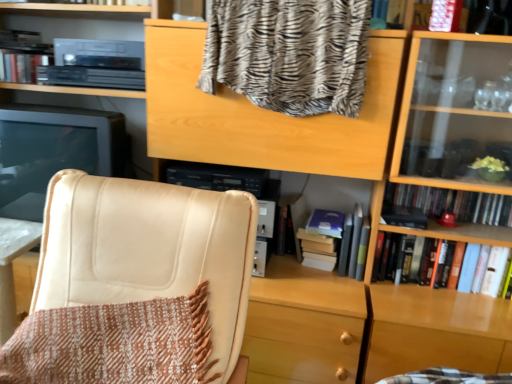
What do you see at coordinates (135, 285) in the screenshot? The height and width of the screenshot is (384, 512). I see `beige leather chair at left` at bounding box center [135, 285].

The width and height of the screenshot is (512, 384). Describe the element at coordinates (452, 203) in the screenshot. I see `hardcover book at right, the second book when ordered from top to bottom` at that location.

You are a GUI agent. You are given a task and a screenshot of the screen. Output one action in this format:
    pyautogui.click(x=<x>, y=<y>)
    Task: Click on the zebra-patterned fabric at upper center, which is the 1th blanket in top-to-bottom order
    
    Given the screenshot: What is the action you would take?
    (x=289, y=53)

The image size is (512, 384). Describe the element at coordinates (21, 66) in the screenshot. I see `hardcover book at left, the fourth book from the bottom` at that location.

Looking at this image, what is the approximate height of gray matte book at center, arranged as the second book when viewed from the left?

It is 10.33 inches.

This screenshot has width=512, height=384. What do you see at coordinates (415, 259) in the screenshot?
I see `hardcover book at right, the 3th book viewed from the left` at bounding box center [415, 259].

The height and width of the screenshot is (384, 512). What are the coordinates of `beige leather chair at left` in the screenshot? It's located at (135, 285).

Which is more to the right, hardcover book at right, acting as the second book starting from the right, or satin black monitor at left?

hardcover book at right, acting as the second book starting from the right.

How many degrees apart are the facing directions of hardcover book at right, which appears as the 4th book when viewed from the top, and satin black monitor at left?

They differ by 3.62 degrees in their facing directions.

Considering the relative sizes of hardcover book at right, the 3th book viewed from the left, and satin black monitor at left in the image provided, is hardcover book at right, the 3th book viewed from the left, smaller than satin black monitor at left?

Yes, hardcover book at right, the 3th book viewed from the left, is smaller than satin black monitor at left.

Which is closer to the camera, (454,258) or (22,211)?

Point (454,258).

Is point (9, 68) less distant than point (104, 131)?

No, (9, 68) is behind (104, 131).

Looking at their sizes, would you say hardcover book at left, which ranks as the 4th book in right-to-left order, is wider or thinner than satin black monitor at left?

Considering their sizes, hardcover book at left, which ranks as the 4th book in right-to-left order, looks slimmer than satin black monitor at left.

Does hardcover book at left, the 1th book from the left, have a lesser height compared to satin black monitor at left?

Yes.

Is hardcover book at left, which ranks as the 4th book in right-to-left order, aimed at satin black monitor at left?

No, hardcover book at left, which ranks as the 4th book in right-to-left order, is not facing towards satin black monitor at left.

Which is correct: hardcover book at left, which is the first book from top to bottom, is inside beige leather chair at left, or outside of it?

The correct answer is: outside.

Is hardcover book at left, which ranks as the 4th book in right-to-left order, aimed at beige leather chair at left?

No, hardcover book at left, which ranks as the 4th book in right-to-left order, is not oriented towards beige leather chair at left.

Is point (1, 58) farther from viewer compared to point (99, 258)?

Yes, point (1, 58) is behind point (99, 258).

Considering the relative sizes of brown woven blanket at lower left, the 2th blanket in the top-to-bottom sequence, and hardcover book at right, which ranks as the first book in right-to-left order, in the image provided, is brown woven blanket at lower left, the 2th blanket in the top-to-bottom sequence, taller than hardcover book at right, which ranks as the first book in right-to-left order,?

Yes, brown woven blanket at lower left, the 2th blanket in the top-to-bottom sequence, is taller than hardcover book at right, which ranks as the first book in right-to-left order.

Is the surface of brown woven blanket at lower left, which appears as the 1th blanket when ordered from the bottom, in direct contact with hardcover book at right, the second book when ordered from top to bottom?

They are not placed beside each other.

Locate an element on the screen. The height and width of the screenshot is (384, 512). blanket that appears below the hardcover book at right, which ranks as the 3th book in bottom-to-top order (from a real-world perspective) is located at coordinates (113, 344).

Is brown woven blanket at lower left, the 2th blanket in the top-to-bottom sequence, oriented towards hardcover book at right, which ranks as the 3th book in bottom-to-top order?

No, brown woven blanket at lower left, the 2th blanket in the top-to-bottom sequence, is not aimed at hardcover book at right, which ranks as the 3th book in bottom-to-top order.

Can you confirm if brown woven blanket at lower left, the 2th blanket in the top-to-bottom sequence, is positioned to the right of satin black monitor at left?

Yes, brown woven blanket at lower left, the 2th blanket in the top-to-bottom sequence, is to the right of satin black monitor at left.

Based on the photo, who is taller, brown woven blanket at lower left, the 2th blanket in the top-to-bottom sequence, or satin black monitor at left?

With more height is satin black monitor at left.

Is brown woven blanket at lower left, which appears as the 1th blanket when ordered from the bottom, aimed at satin black monitor at left?

No, brown woven blanket at lower left, which appears as the 1th blanket when ordered from the bottom, is not turned towards satin black monitor at left.

In the scene shown: Is brown woven blanket at lower left, which appears as the 1th blanket when ordered from the bottom, outside of satin black monitor at left?

brown woven blanket at lower left, which appears as the 1th blanket when ordered from the bottom, is positioned outside satin black monitor at left.

Based on the photo, visually, is brown woven blanket at lower left, which appears as the 1th blanket when ordered from the bottom, positioned to the left or to the right of hardcover book at left, which ranks as the 4th book in right-to-left order?

Clearly, brown woven blanket at lower left, which appears as the 1th blanket when ordered from the bottom, is on the right of hardcover book at left, which ranks as the 4th book in right-to-left order, in the image.

How many degrees apart are the facing directions of brown woven blanket at lower left, which appears as the 1th blanket when ordered from the bottom, and hardcover book at left, which is the first book from top to bottom?

A: 0.0821 degrees.

Does brown woven blanket at lower left, the 2th blanket in the top-to-bottom sequence, have a lesser width compared to hardcover book at left, which is the first book from top to bottom?

Incorrect, the width of brown woven blanket at lower left, the 2th blanket in the top-to-bottom sequence, is not less than that of hardcover book at left, which is the first book from top to bottom.

Looking at the image, does brown woven blanket at lower left, which appears as the 1th blanket when ordered from the bottom, seem bigger or smaller compared to hardcover book at left, which is the first book from top to bottom?

Considering their sizes, brown woven blanket at lower left, which appears as the 1th blanket when ordered from the bottom, takes up more space than hardcover book at left, which is the first book from top to bottom.

Consider the image. Are hardcover book at right, which appears as the 4th book when viewed from the top, and zebra-patterned fabric at upper center, which appears as the second blanket when ordered from the bottom, far apart?

Actually, hardcover book at right, which appears as the 4th book when viewed from the top, and zebra-patterned fabric at upper center, which appears as the second blanket when ordered from the bottom, are a little close together.

Does hardcover book at right, which appears as the 4th book when viewed from the top, have a greater width compared to zebra-patterned fabric at upper center, which appears as the second blanket when ordered from the bottom?

No, hardcover book at right, which appears as the 4th book when viewed from the top, is not wider than zebra-patterned fabric at upper center, which appears as the second blanket when ordered from the bottom.

From the image's perspective, which object appears higher, hardcover book at right, the 3th book viewed from the left, or zebra-patterned fabric at upper center, which appears as the second blanket when ordered from the bottom?

zebra-patterned fabric at upper center, which appears as the second blanket when ordered from the bottom.

Based on the photo, is hardcover book at right, the 3th book viewed from the left, positioned with its back to zebra-patterned fabric at upper center, which is the 1th blanket in top-to-bottom order?

That's not correct — hardcover book at right, the 3th book viewed from the left, is not looking away from zebra-patterned fabric at upper center, which is the 1th blanket in top-to-bottom order.

The height and width of the screenshot is (384, 512). Find the location of `computer monitor that appears above the hardcover book at right, which appears as the 4th book when viewed from the top (from the image's perspective)`. computer monitor that appears above the hardcover book at right, which appears as the 4th book when viewed from the top (from the image's perspective) is located at coordinates (53, 151).

Identify the location of computer monitor in front of the hardcover book at left, which is the first book from top to bottom. point(53,151).

From the image, which object appears to be farther from satin black monitor at left, brown woven blanket at lower left, which appears as the 1th blanket when ordered from the bottom, or gray matte book at center, which is the second book in bottom-to-top order?

gray matte book at center, which is the second book in bottom-to-top order.

Looking at the image, which one is located further to hardcover book at right, acting as the second book starting from the right, hardcover book at left, which is the first book from top to bottom, or zebra-patterned fabric at upper center, which appears as the second blanket when ordered from the bottom?

Among the two, hardcover book at left, which is the first book from top to bottom, is located further to hardcover book at right, acting as the second book starting from the right.

From the image, which object appears to be nearer to hardcover book at right, the 3th book viewed from the left, gray matte book at center, which is the second book in bottom-to-top order, or hardcover book at right, which ranks as the 3th book in bottom-to-top order?

gray matte book at center, which is the second book in bottom-to-top order, is positioned closer to the anchor hardcover book at right, the 3th book viewed from the left.

Based on their spatial positions, is hardcover book at right, which ranks as the 3th book in bottom-to-top order, or hardcover book at right, the 3th book viewed from the left, closer to beige leather chair at left?

The object closer to beige leather chair at left is hardcover book at right, the 3th book viewed from the left.

Considering their positions, is zebra-patterned fabric at upper center, which appears as the second blanket when ordered from the bottom, positioned closer to hardcover book at left, the 1th book from the left, than hardcover book at right, which appears as the 4th book when viewed from the top?

zebra-patterned fabric at upper center, which appears as the second blanket when ordered from the bottom, is closer to hardcover book at left, the 1th book from the left.

Consider the image. Estimate the real-world distances between objects in this image. Which object is closer to brown woven blanket at lower left, which appears as the 1th blanket when ordered from the bottom, hardcover book at right, acting as the second book starting from the right, or hardcover book at left, which ranks as the 4th book in right-to-left order?

hardcover book at right, acting as the second book starting from the right.

Considering their positions, is hardcover book at left, the fourth book from the bottom, positioned closer to gray matte book at center, the third book when ordered from top to bottom, than zebra-patterned fabric at upper center, which is the 1th blanket in top-to-bottom order?

zebra-patterned fabric at upper center, which is the 1th blanket in top-to-bottom order, lies closer to gray matte book at center, the third book when ordered from top to bottom, than the other object.

From the image, which object appears to be farther from hardcover book at left, the 1th book from the left, hardcover book at right, the 3th book viewed from the left, or zebra-patterned fabric at upper center, which appears as the second blanket when ordered from the bottom?

Among the two, hardcover book at right, the 3th book viewed from the left, is located further to hardcover book at left, the 1th book from the left.

Locate an element on the screen. This screenshot has width=512, height=384. book located between beige leather chair at left and gray matte book at center, which is the second book in bottom-to-top order, in the depth direction is located at coordinates (415, 259).

This screenshot has width=512, height=384. Find the location of `blanket between hardcover book at left, the fourth book from the bottom, and brown woven blanket at lower left, which appears as the 1th blanket when ordered from the bottom, vertically`. blanket between hardcover book at left, the fourth book from the bottom, and brown woven blanket at lower left, which appears as the 1th blanket when ordered from the bottom, vertically is located at coordinates (289, 53).

Locate an element on the screen. The width and height of the screenshot is (512, 384). computer monitor between hardcover book at left, which ranks as the 4th book in right-to-left order, and zebra-patterned fabric at upper center, which appears as the second blanket when ordered from the bottom is located at coordinates (53, 151).

Locate an element on the screen. computer monitor located between beige leather chair at left and gray matte book at center, the 3th book in the right-to-left sequence, in the depth direction is located at coordinates (53, 151).